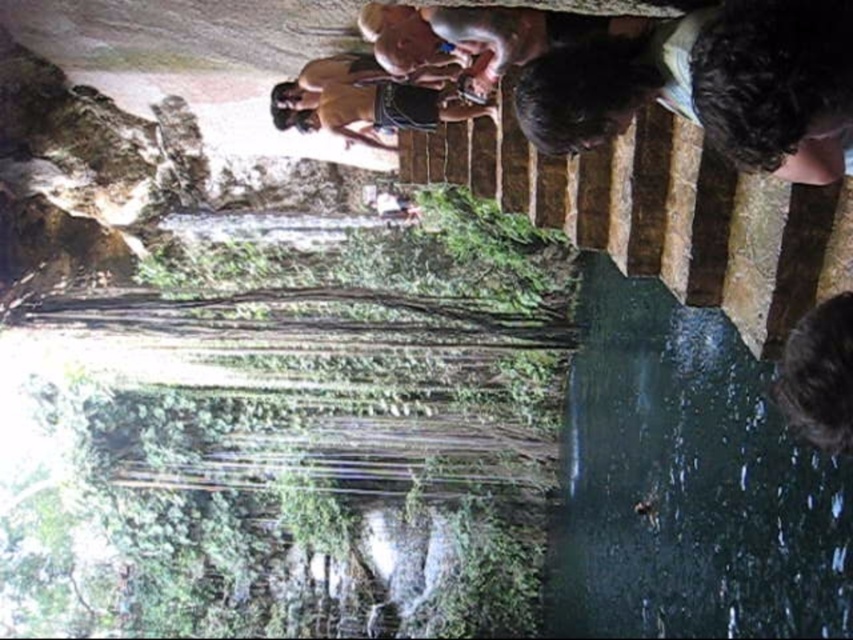
Question: Can you confirm if greenish water at center is smaller than brown skin person at upper center?

Choices:
 (A) yes
 (B) no

Answer: (B)

Question: Which object appears closest to the camera in this image?

Choices:
 (A) dark curly hair at upper center
 (B) dark brown hair at lower right
 (C) clear water at bottom right

Answer: (A)

Question: Does dark curly hair at upper center have a greater width compared to brown skin person at upper center?

Choices:
 (A) yes
 (B) no

Answer: (B)

Question: Among these objects, which one is nearest to the camera?

Choices:
 (A) brown skin person at upper center
 (B) clear water at bottom right

Answer: (B)

Question: Which point is farther from the camera taking this photo?

Choices:
 (A) (318, 122)
 (B) (699, 65)
 (C) (155, 364)

Answer: (C)

Question: Can you confirm if greenish water at center is bigger than clear water at bottom right?

Choices:
 (A) yes
 (B) no

Answer: (A)